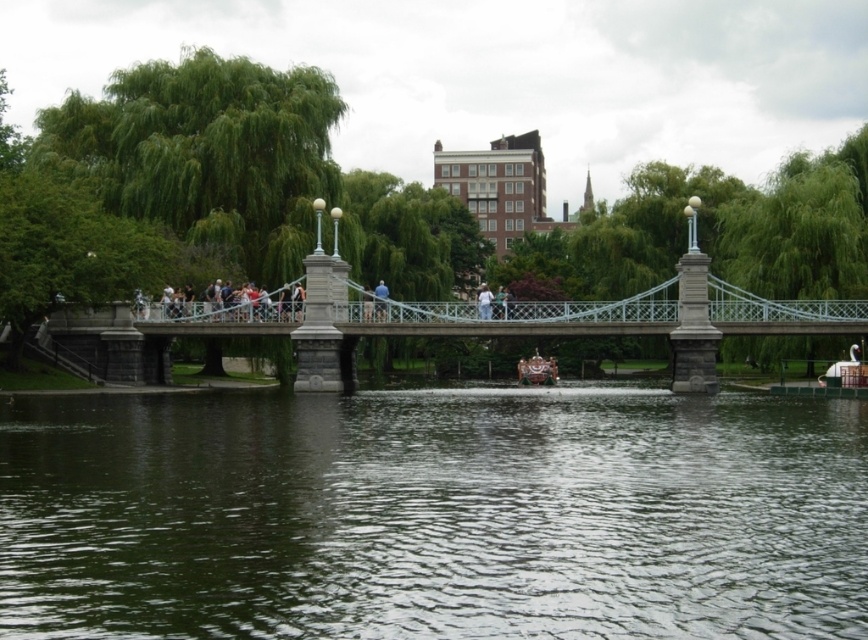
You are standing on the metallic gray bridge at center and looking towards the greenish water at center. Which object is closer to you?

The greenish water at center is in front of the metallic gray bridge at center, so the greenish water at center is closer to you.